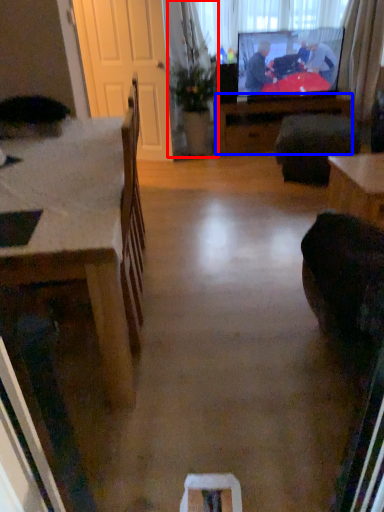
Question: Which object is further to the camera taking this photo, houseplant (highlighted by a red box) or table (highlighted by a blue box)?

Choices:
 (A) houseplant
 (B) table

Answer: (B)